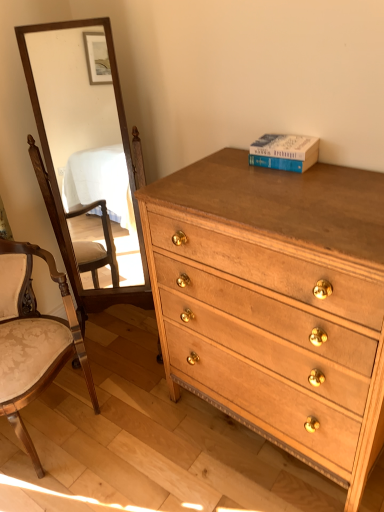
Where is `vacant space to the right of wooden upholstered chair at left`? The image size is (384, 512). vacant space to the right of wooden upholstered chair at left is located at coordinates (148, 424).